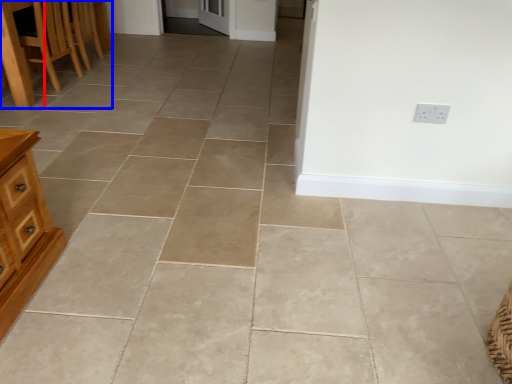
Question: Which point is further to the camera, table (highlighted by a red box) or furniture (highlighted by a blue box)?

Choices:
 (A) table
 (B) furniture

Answer: (A)